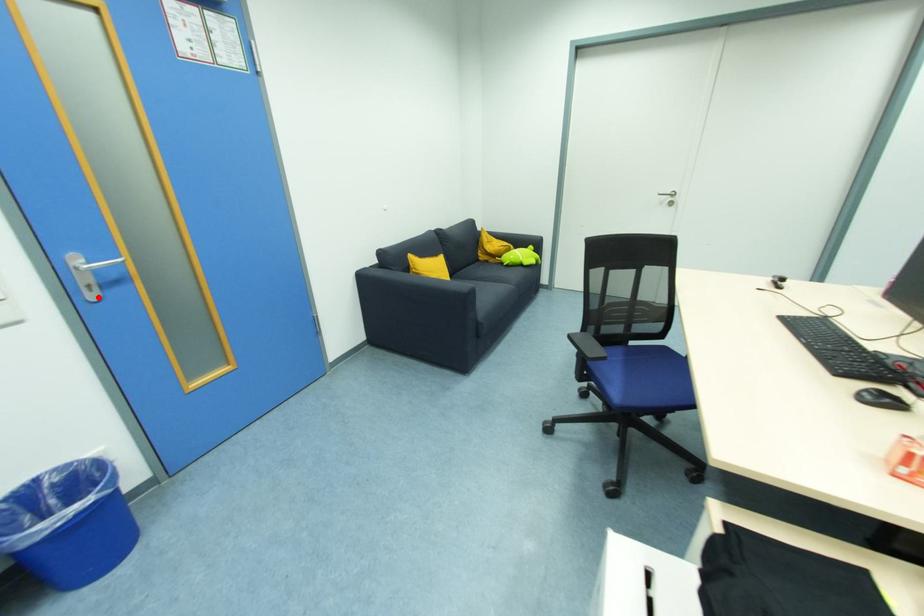
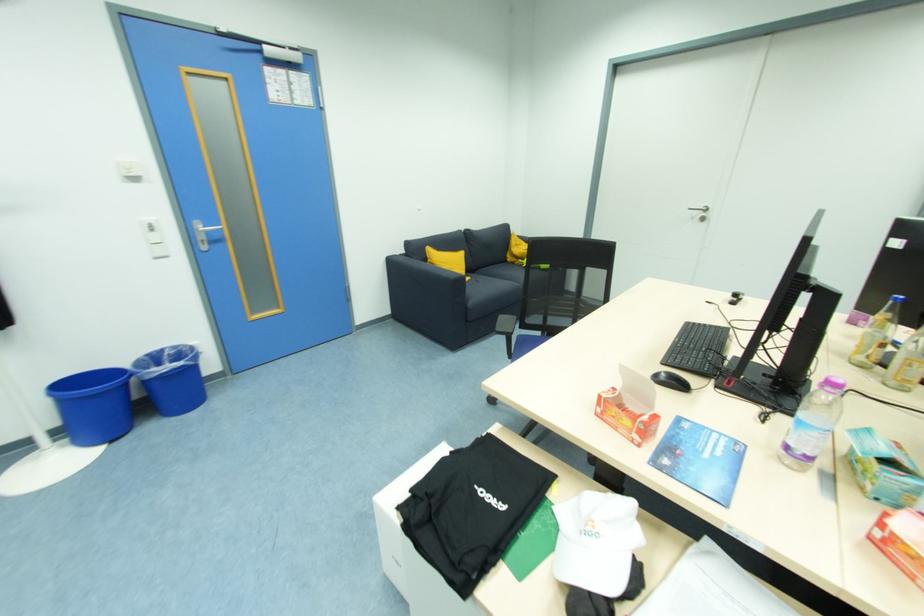
In the second image, find the point that corresponds to the highlighted location in the first image.

(208, 249)